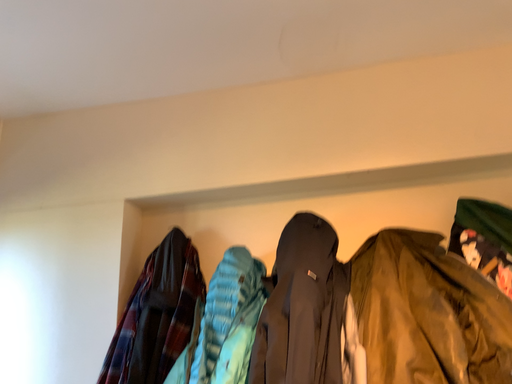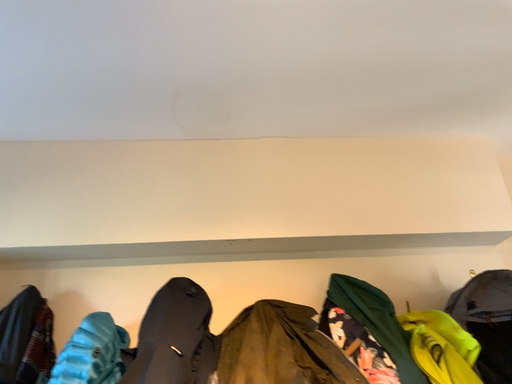
Question: How did the camera likely rotate when shooting the video?

Choices:
 (A) rotated left
 (B) rotated right

Answer: (B)